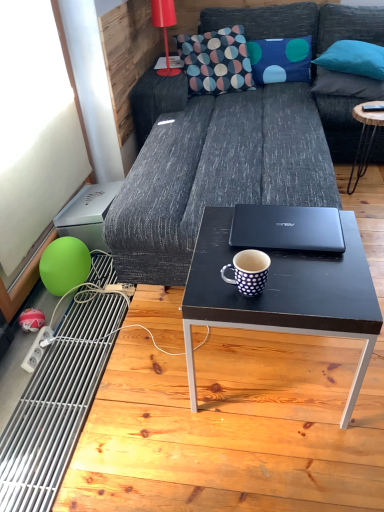
This screenshot has width=384, height=512. What are the coordinates of `free space to the left of white dotted ceramic mug at center` in the screenshot? It's located at (206, 287).